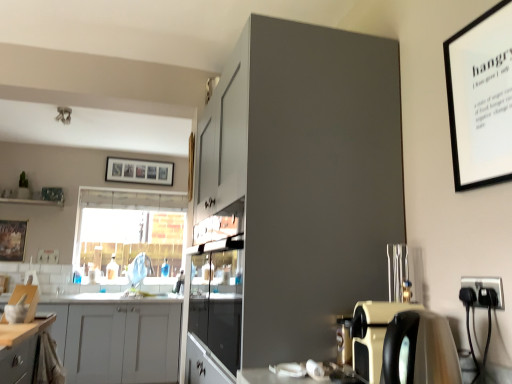
Question: Is clear glass window at center thinner than matte gray cabinet at upper center, acting as the second cabinetry starting from the left?

Choices:
 (A) yes
 (B) no

Answer: (A)

Question: Does clear glass window at center lie in front of matte gray cabinet at upper center, the second cabinetry positioned from the bottom?

Choices:
 (A) no
 (B) yes

Answer: (A)

Question: Considering the relative sizes of clear glass window at center and matte gray cabinet at upper center, the 1th cabinetry viewed from the right, in the image provided, is clear glass window at center smaller than matte gray cabinet at upper center, the 1th cabinetry viewed from the right,?

Choices:
 (A) yes
 (B) no

Answer: (A)

Question: Can you confirm if clear glass window at center is positioned to the right of matte gray cabinet at upper center, positioned as the second cabinetry in back-to-front order?

Choices:
 (A) no
 (B) yes

Answer: (A)

Question: From the image's perspective, is clear glass window at center located beneath matte gray cabinet at upper center, positioned as the second cabinetry in back-to-front order?

Choices:
 (A) no
 (B) yes

Answer: (B)

Question: From a real-world perspective, is clear glass window at center on matte gray cabinet at upper center, the 1th cabinetry viewed from the right?

Choices:
 (A) no
 (B) yes

Answer: (B)

Question: From the image's perspective, would you say transparent glass cabinet at center is shown under clear glass window at center?

Choices:
 (A) yes
 (B) no

Answer: (B)

Question: Is transparent glass cabinet at center surrounding clear glass window at center?

Choices:
 (A) no
 (B) yes

Answer: (A)

Question: From the image's perspective, is transparent glass cabinet at center on clear glass window at center?

Choices:
 (A) yes
 (B) no

Answer: (A)

Question: Is the surface of transparent glass cabinet at center in direct contact with clear glass window at center?

Choices:
 (A) no
 (B) yes

Answer: (A)

Question: From a real-world perspective, does transparent glass cabinet at center sit lower than clear glass window at center?

Choices:
 (A) yes
 (B) no

Answer: (A)

Question: Considering the relative sizes of transparent glass cabinet at center and clear glass window at center in the image provided, is transparent glass cabinet at center bigger than clear glass window at center?

Choices:
 (A) no
 (B) yes

Answer: (A)

Question: Is matte gray cabinet at upper center, the 1th cabinetry viewed from the right, positioned far away from wooden framed artwork at left, the 2th picture frame in the top-to-bottom sequence?

Choices:
 (A) yes
 (B) no

Answer: (A)